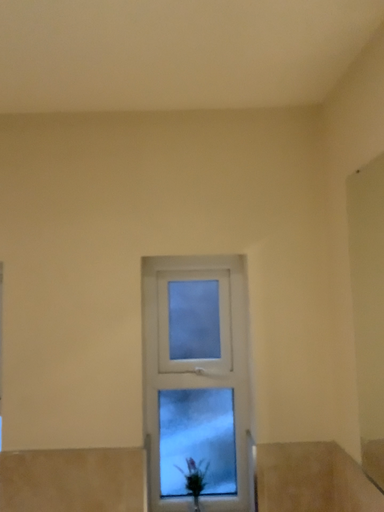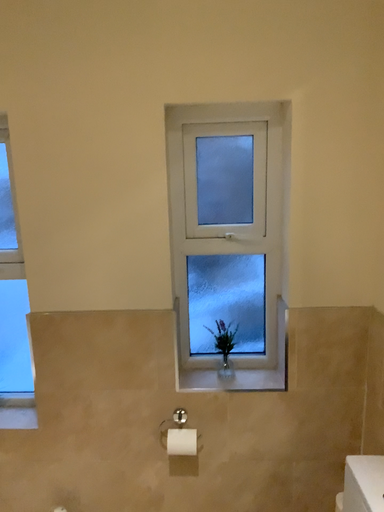
Question: How did the camera likely rotate when shooting the video?

Choices:
 (A) rotated upward
 (B) rotated downward

Answer: (B)